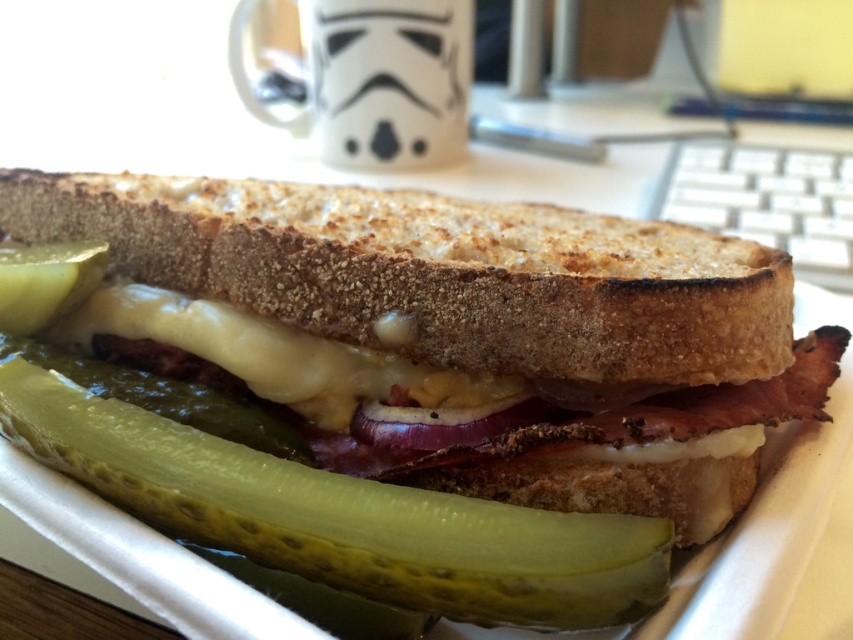
Is green pickled vegetable at center to the right of white melted cheese at center from the viewer's perspective?

Yes, green pickled vegetable at center is to the right of white melted cheese at center.

Who is taller, green pickled vegetable at center or white melted cheese at center?

Standing taller between the two is green pickled vegetable at center.

Find the location of a particular element. The width and height of the screenshot is (853, 640). green pickled vegetable at center is located at coordinates (343, 516).

Which is in front, point (453, 252) or point (306, 112)?

Point (453, 252)

Where is `toasted bread at center`? This screenshot has width=853, height=640. toasted bread at center is located at coordinates (459, 332).

Can you confirm if white ceramic mug at upper center is thinner than white melted cheese at center?

Correct, white ceramic mug at upper center's width is less than white melted cheese at center's.

Who is positioned more to the right, white ceramic mug at upper center or white melted cheese at center?

From the viewer's perspective, white melted cheese at center appears more on the right side.

This screenshot has height=640, width=853. Identify the location of white ceramic mug at upper center. (376, 80).